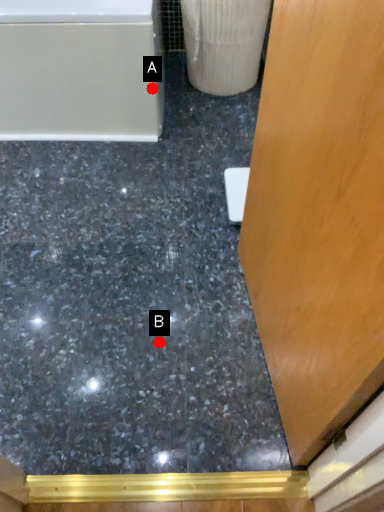
Question: Two points are circled on the image, labeled by A and B beside each circle. Among these points, which one is farthest from the camera?

Choices:
 (A) A is further
 (B) B is further

Answer: (A)